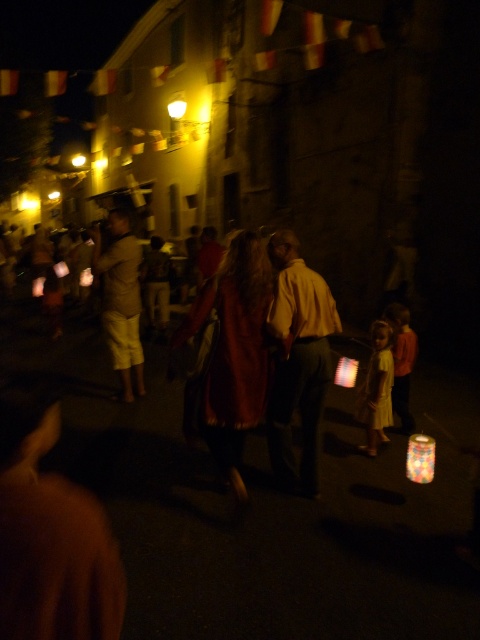
You are a delivery robot with a width of 12 inches. You need to pass between the velvet red coat at center and the yellow matte shirt at center. Is there enough space for you to move through?

The distance between the velvet red coat at center and the yellow matte shirt at center is 13.12 inches, so the robot can pass through as it is wider than the robot.